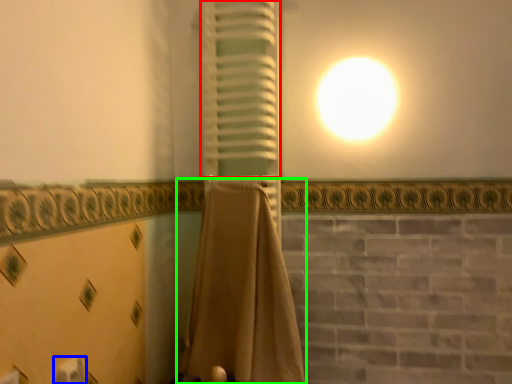
Question: Which object is positioned closest to curtain (highlighted by a red box)? Select from toilet paper (highlighted by a blue box) and curtain (highlighted by a green box).

Choices:
 (A) toilet paper
 (B) curtain

Answer: (B)